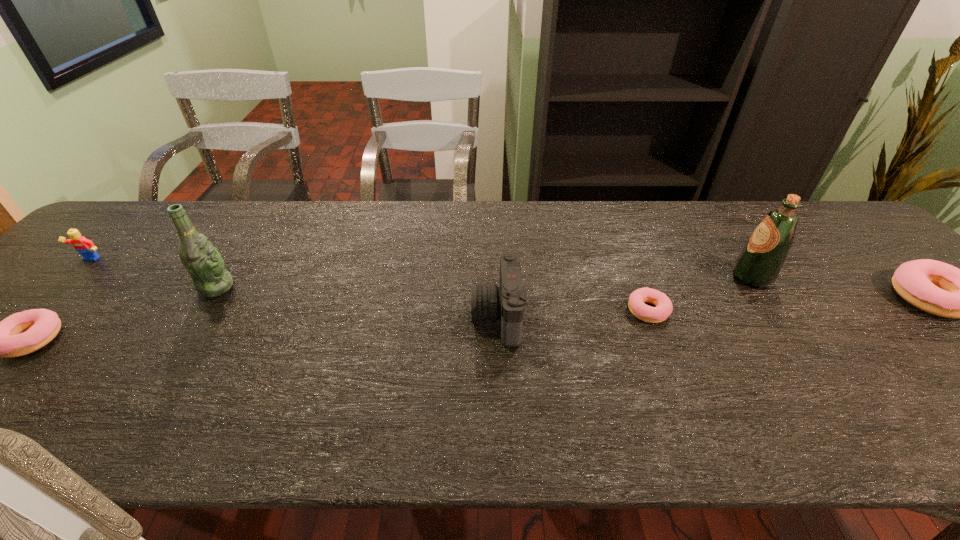
Locate an element on the screen. This screenshot has height=540, width=960. blank space that satisfies the following two spatial constraints: 1. on the surface of the beer bottle; 2. on the right side of the shortest doughnut is located at coordinates (202, 310).